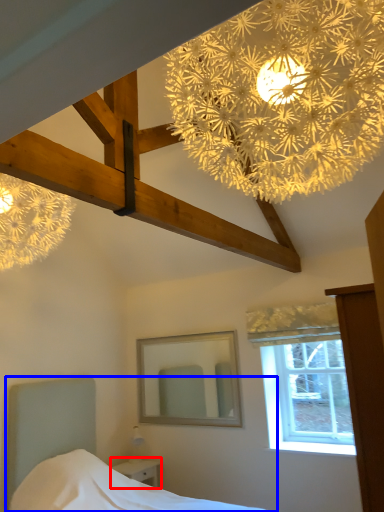
Question: Among these objects, which one is nearest to the camera, nightstand (highlighted by a red box) or bed (highlighted by a blue box)?

Choices:
 (A) nightstand
 (B) bed

Answer: (B)